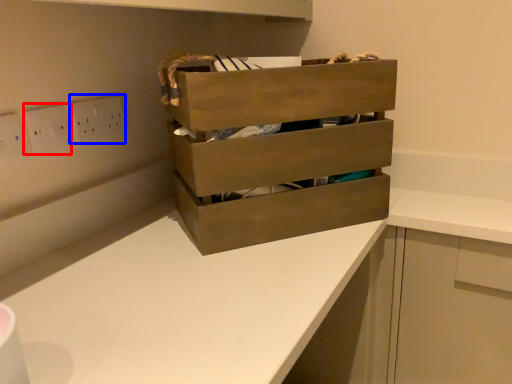
Question: Among these objects, which one is farthest to the camera, electric outlet (highlighted by a red box) or electric outlet (highlighted by a blue box)?

Choices:
 (A) electric outlet
 (B) electric outlet

Answer: (B)